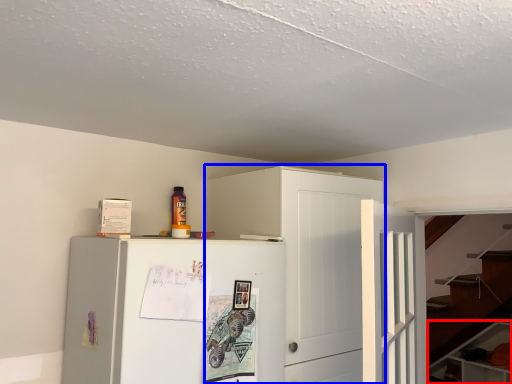
Question: Which object is closer to the camera taking this photo, cabinetry (highlighted by a red box) or cabinetry (highlighted by a blue box)?

Choices:
 (A) cabinetry
 (B) cabinetry

Answer: (B)